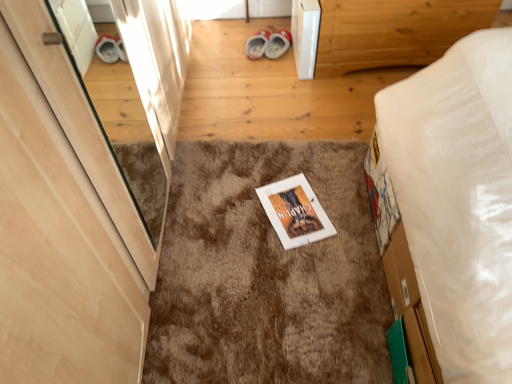
Question: From the image's perspective, is brown shaggy carpet at center beneath red suede shoes at center?

Choices:
 (A) no
 (B) yes

Answer: (B)

Question: From a real-world perspective, is brown shaggy carpet at center physically above red suede shoes at center?

Choices:
 (A) no
 (B) yes

Answer: (A)

Question: Can you confirm if brown shaggy carpet at center is thinner than red suede shoes at center?

Choices:
 (A) no
 (B) yes

Answer: (A)

Question: Does brown shaggy carpet at center appear on the left side of red suede shoes at center?

Choices:
 (A) yes
 (B) no

Answer: (B)

Question: Is brown shaggy carpet at center closer to the viewer compared to red suede shoes at center?

Choices:
 (A) yes
 (B) no

Answer: (A)

Question: In terms of size, does wooden bed frame at upper right appear bigger or smaller than brown shaggy carpet at center?

Choices:
 (A) small
 (B) big

Answer: (B)

Question: From a real-world perspective, is wooden bed frame at upper right above or below brown shaggy carpet at center?

Choices:
 (A) above
 (B) below

Answer: (A)

Question: Looking at their shapes, would you say wooden bed frame at upper right is wider or thinner than brown shaggy carpet at center?

Choices:
 (A) wide
 (B) thin

Answer: (B)

Question: From the image's perspective, is wooden bed frame at upper right above or below brown shaggy carpet at center?

Choices:
 (A) below
 (B) above

Answer: (B)

Question: From the image's perspective, is red suede shoes at center above or below wooden bed frame at upper right?

Choices:
 (A) below
 (B) above

Answer: (A)

Question: In terms of width, does red suede shoes at center look wider or thinner when compared to wooden bed frame at upper right?

Choices:
 (A) wide
 (B) thin

Answer: (B)

Question: Is point (267, 39) closer or farther from the camera than point (325, 3)?

Choices:
 (A) farther
 (B) closer

Answer: (A)

Question: Is red suede shoes at center spatially inside wooden bed frame at upper right, or outside of it?

Choices:
 (A) inside
 (B) outside

Answer: (B)

Question: Is wooden bed frame at upper right inside or outside of light wood door at left?

Choices:
 (A) outside
 (B) inside

Answer: (A)

Question: Relative to light wood door at left, is wooden bed frame at upper right in front or behind?

Choices:
 (A) front
 (B) behind

Answer: (B)